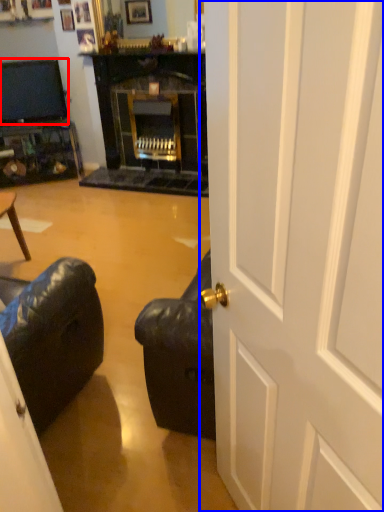
Question: Which object appears farthest to the camera in this image, television (highlighted by a red box) or door (highlighted by a blue box)?

Choices:
 (A) television
 (B) door

Answer: (A)